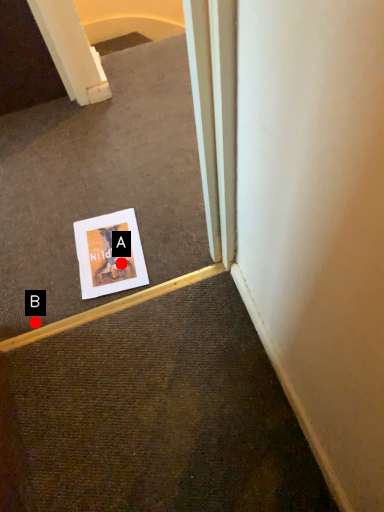
Question: Two points are circled on the image, labeled by A and B beside each circle. Which point appears farthest from the camera in this image?

Choices:
 (A) A is further
 (B) B is further

Answer: (A)